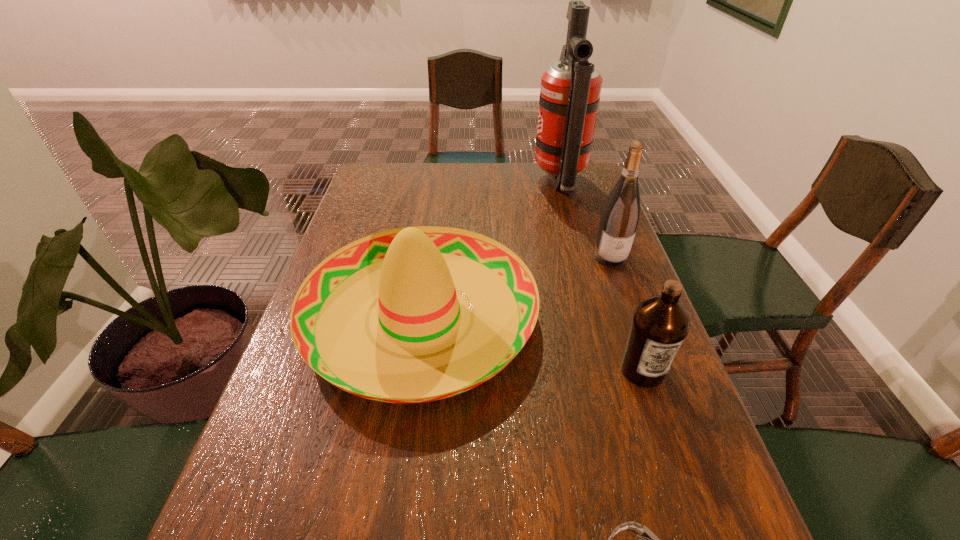
Identify the location of fire extinguisher. (570, 91).

The width and height of the screenshot is (960, 540). Find the location of `the tallest object`. the tallest object is located at coordinates (570, 91).

Identify the location of the second tallest object. (620, 216).

This screenshot has height=540, width=960. Find the location of `sombrero`. sombrero is located at coordinates (421, 342).

Image resolution: width=960 pixels, height=540 pixels. In order to click on olive oil in this screenshot , I will do `click(660, 324)`.

You are a GUI agent. You are given a task and a screenshot of the screen. Output one action in this format:
    pyautogui.click(x=<x>, y=<y>)
    Task: Click on the vacant space situated 0.100m on the front label side of the farthest object
    This screenshot has width=960, height=540.
    Given the screenshot: What is the action you would take?
    pyautogui.click(x=505, y=183)

Where is `vacant space located 0.140m on the front label side of the farthest object`? The height and width of the screenshot is (540, 960). vacant space located 0.140m on the front label side of the farthest object is located at coordinates (493, 183).

Where is `free region located 0.340m on the front label side of the farthest object`? free region located 0.340m on the front label side of the farthest object is located at coordinates (437, 183).

Identify the location of free space located on the label of the fourth shortest object. (619, 283).

The height and width of the screenshot is (540, 960). I want to click on vacant region located 0.230m on the back of the leftmost object, so click(x=436, y=204).